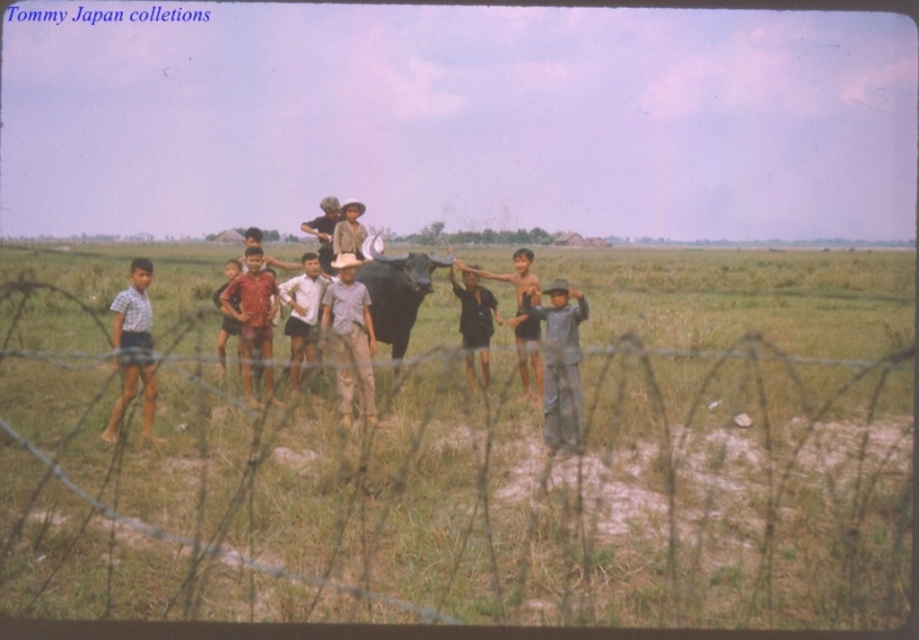
You are a photographer standing at the edge of the field, and you want to take a photo of the checkered fabric shirt at left and the light brown skin at center. Your camera has a maximum focus range of 2 meters. Can you capture both subjects in focus without moving closer?

The distance between the checkered fabric shirt at left and light brown skin at center is 2.39 meters. Since the camera can only focus within 2 meters, the subjects are slightly out of the focus range. You might need to adjust your position or use a different lens to ensure both are in focus.